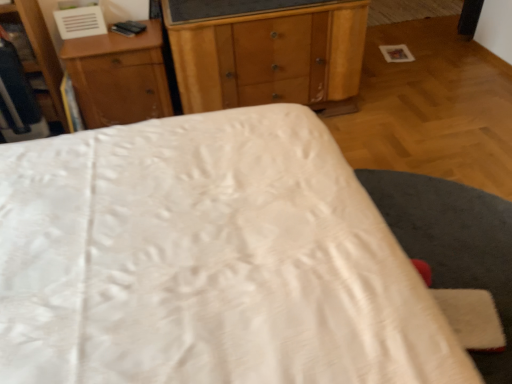
Question: In terms of height, does wooden dresser at left look taller or shorter compared to wooden nightstand at upper center?

Choices:
 (A) tall
 (B) short

Answer: (A)

Question: Is wooden dresser at left inside the boundaries of wooden nightstand at upper center, or outside?

Choices:
 (A) outside
 (B) inside

Answer: (A)

Question: Estimate the real-world distances between objects in this image. Which object is closer to the wooden chest of drawers at center?

Choices:
 (A) wooden dresser at left
 (B) white satin bed at center
 (C) wooden nightstand at upper center

Answer: (C)

Question: Which of these objects is positioned farthest from the wooden dresser at left?

Choices:
 (A) white satin bed at center
 (B) wooden nightstand at upper center
 (C) wooden chest of drawers at center

Answer: (A)